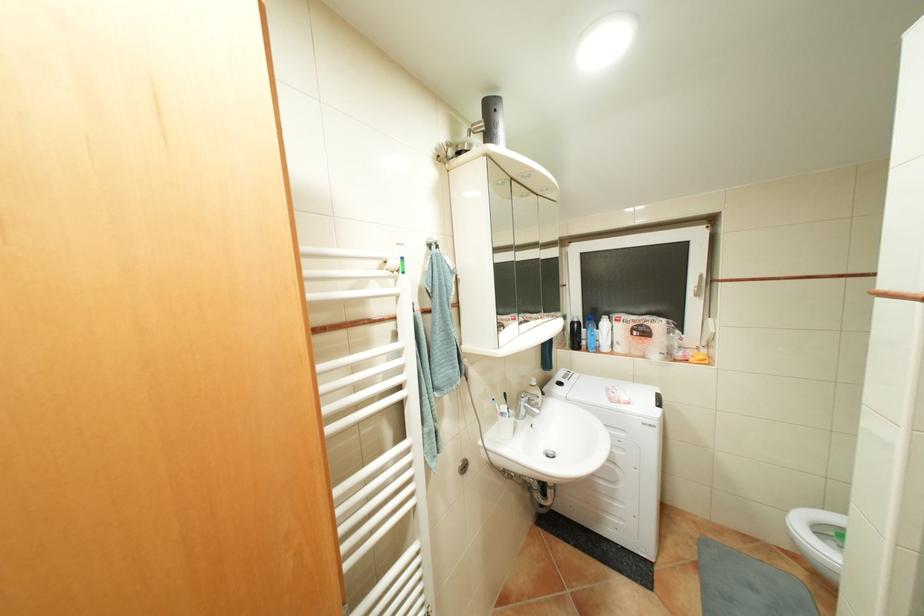
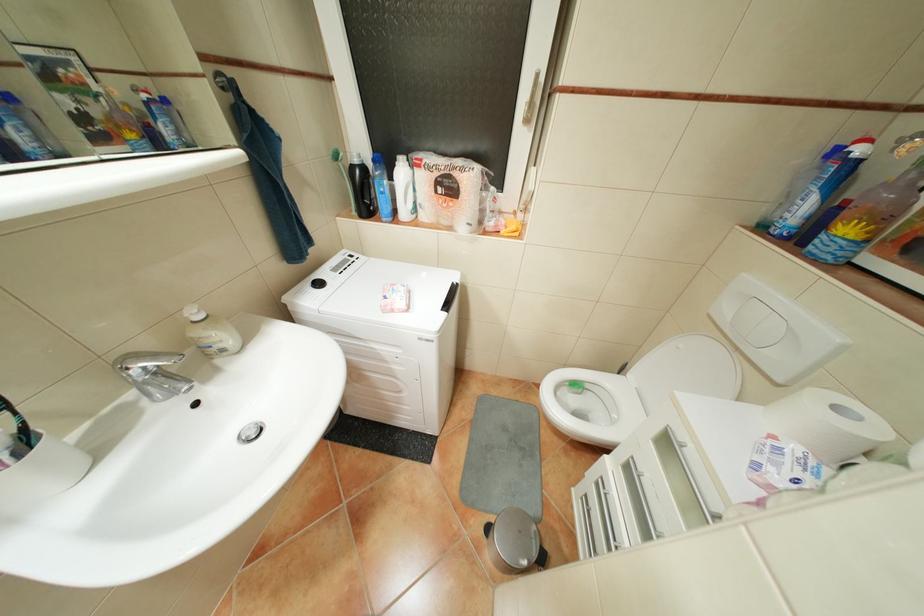
The point at (x=581, y=322) is marked in the first image. Where is the corresponding point in the second image?

(361, 167)